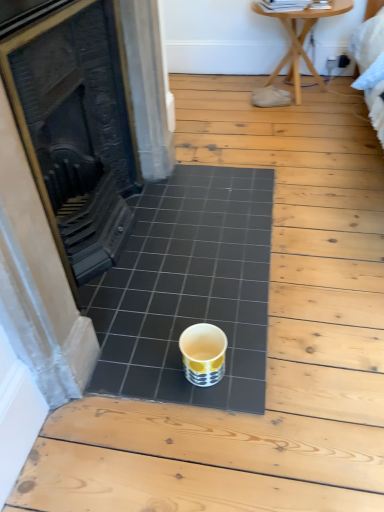
Question: In terms of height, does black cast iron fireplace at center look taller or shorter compared to black ceramic tile at center?

Choices:
 (A) tall
 (B) short

Answer: (A)

Question: Is point coord(99,78) positioned closer to the camera than point coord(251,408)?

Choices:
 (A) closer
 (B) farther

Answer: (B)

Question: Which of these objects is positioned closest to the wooden table at upper right?

Choices:
 (A) black ceramic tile at center
 (B) black cast iron fireplace at center
 (C) yellow and white ceramic cup at center

Answer: (A)

Question: Estimate the real-world distances between objects in this image. Which object is farther from the yellow and white ceramic cup at center?

Choices:
 (A) wooden table at upper right
 (B) black cast iron fireplace at center
 (C) black ceramic tile at center

Answer: (A)